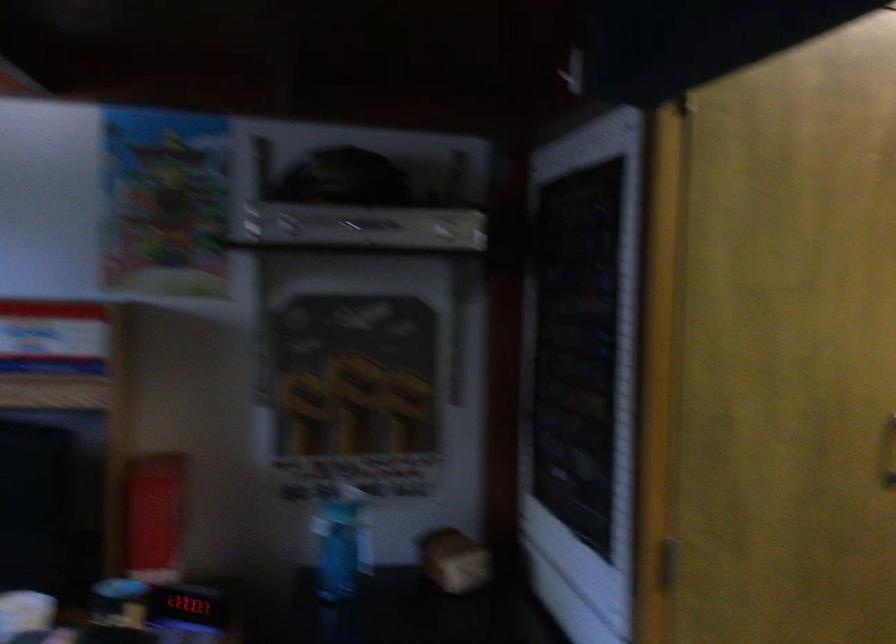
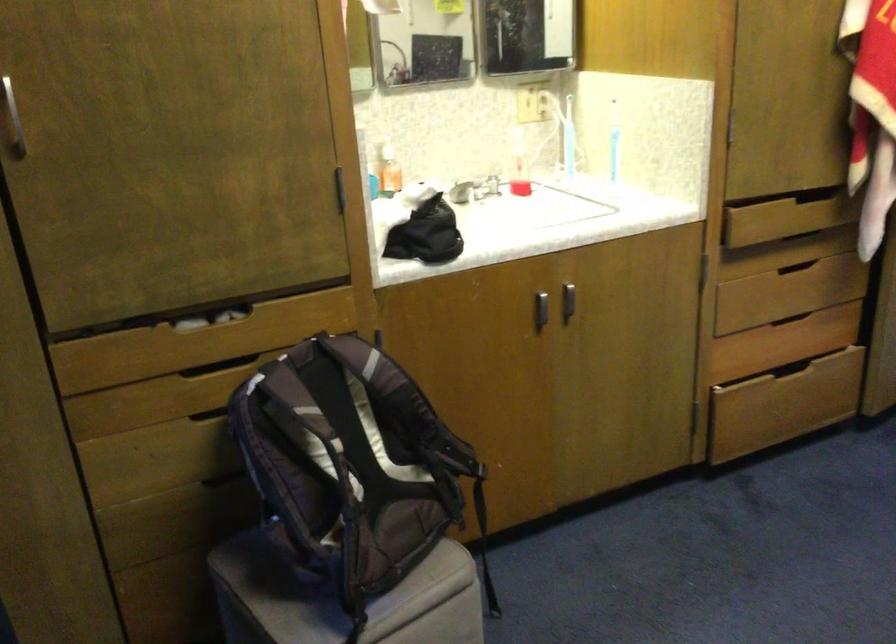
Question: What movement of the cameraman would produce the second image?

Choices:
 (A) Left
 (B) Right
 (C) Forward
 (D) Backward

Answer: (B)